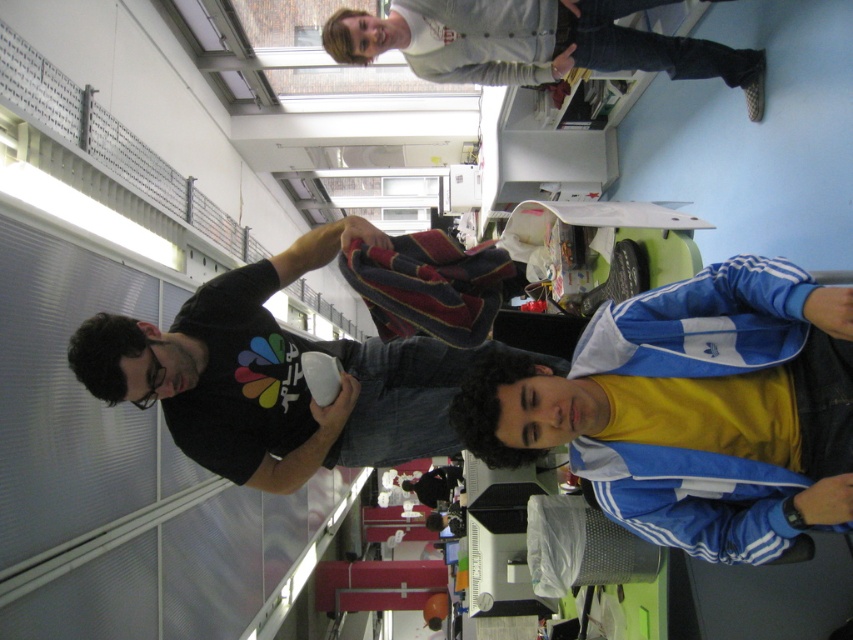
Question: Is blue/white adidas jacket at lower right positioned in front of white cotton shirt at upper center?

Choices:
 (A) no
 (B) yes

Answer: (B)

Question: Which of the following is the closest to the observer?

Choices:
 (A) (817, 339)
 (B) (341, 440)

Answer: (A)

Question: Estimate the real-world distances between objects in this image. Which object is farther from the black matte t-shirt at center?

Choices:
 (A) white cotton shirt at upper center
 (B) blue/white adidas jacket at lower right

Answer: (A)

Question: Which of the following is the farthest from the observer?

Choices:
 (A) blue/white adidas jacket at lower right
 (B) black matte t-shirt at center
 (C) white cotton shirt at upper center

Answer: (C)

Question: Is the position of blue/white adidas jacket at lower right less distant than that of black matte t-shirt at center?

Choices:
 (A) no
 (B) yes

Answer: (B)

Question: Is blue/white adidas jacket at lower right thinner than black matte t-shirt at center?

Choices:
 (A) yes
 (B) no

Answer: (A)